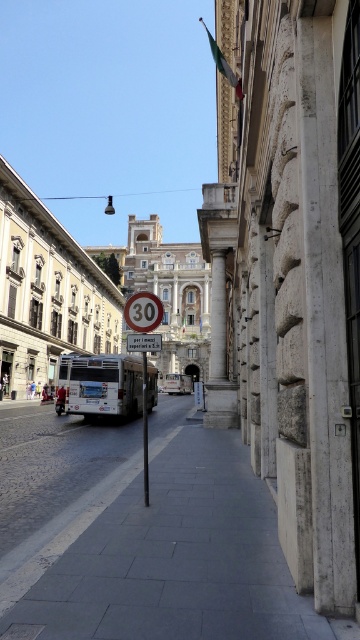
You are a delivery person with a 2.5 meter wide cart. You need to pass between the white matte bus at center and the metallic pole at center. Is there enough space for your cart to go through?

The distance between the white matte bus at center and the metallic pole at center is 2.72 meters. Since your cart is 2.5 meters wide, there is enough space for it to pass through.

You are a delivery driver who needs to park your van near the curb. Your van is 6 meters long. There is a space between the metallic circular speed limit sign at center and the metallic pole at center. Can you fit your van in this space?

The space between the metallic circular speed limit sign at center and the metallic pole at center is 6.64 meters. Since your van is 6 meters long, it can fit in this space as it is slightly shorter than the available space.

In the scene shown: You are a tourist walking on the sidewalk and want to take a photo of the metallic circular speed limit sign at center and the metallic pole at center. Which object should you focus on first if you want both to be in focus without moving the camera?

You should focus on the metallic pole at center first because it is closer to you than the metallic circular speed limit sign at center, which is further away. By focusing on the closer object, the farther one will still be in focus due to depth of field.